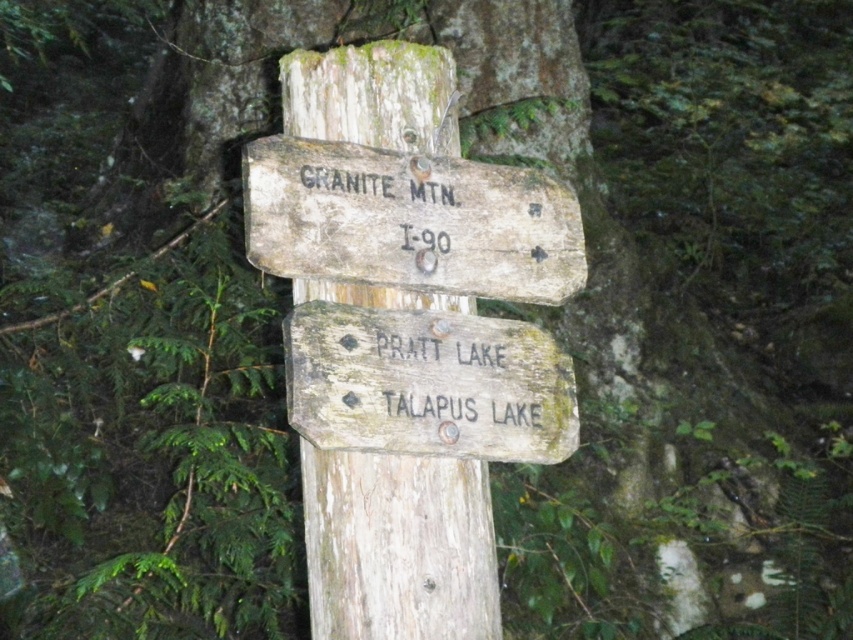
Does weathered wood signpost at center appear on the left side of weathered wood signpost at upper center?

Indeed, weathered wood signpost at center is positioned on the left side of weathered wood signpost at upper center.

Is point (306, 552) behind point (347, 248)?

Yes.

What do you see at coordinates (398, 547) in the screenshot? The width and height of the screenshot is (853, 640). I see `weathered wood signpost at center` at bounding box center [398, 547].

Find the location of a particular element. weathered wood signpost at center is located at coordinates (398, 547).

Which of these two, weathered wood signpost at center or weathered wood sign at center, stands taller?

Standing taller between the two is weathered wood signpost at center.

Does weathered wood signpost at center appear over weathered wood sign at center?

No.

Find the location of `weathered wood signpost at center`. weathered wood signpost at center is located at coordinates (398, 547).

You are a GUI agent. You are given a task and a screenshot of the screen. Output one action in this format:
    pyautogui.click(x=<x>, y=<y>)
    Task: Click on the weathered wood signpost at center
    The height and width of the screenshot is (640, 853).
    Given the screenshot: What is the action you would take?
    [x=398, y=547]

Can you confirm if weathered wood signpost at upper center is positioned below weathered wood sign at center?

No, weathered wood signpost at upper center is not below weathered wood sign at center.

Is weathered wood signpost at upper center behind weathered wood sign at center?

That is True.

Does point (390, 259) come closer to viewer compared to point (468, 342)?

Yes, point (390, 259) is closer to viewer.

The width and height of the screenshot is (853, 640). I want to click on weathered wood signpost at upper center, so click(409, 220).